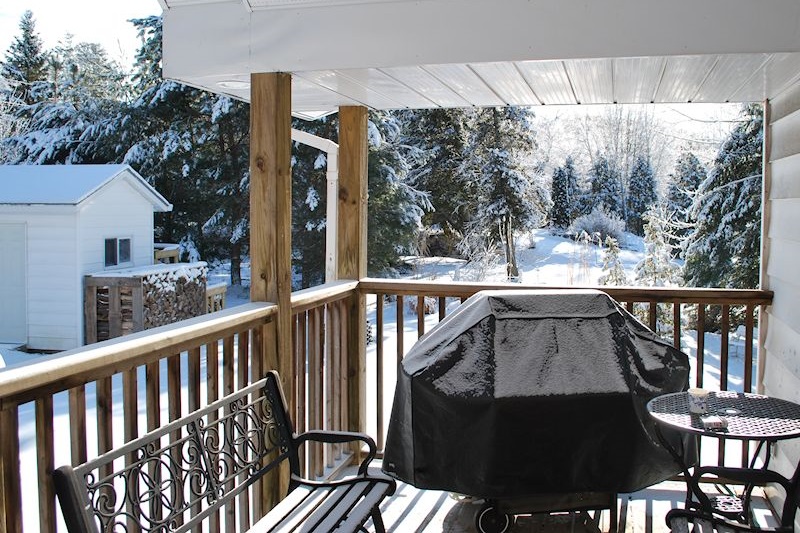
What are the coordinates of `seat of chair on right` in the screenshot? It's located at (700, 524).